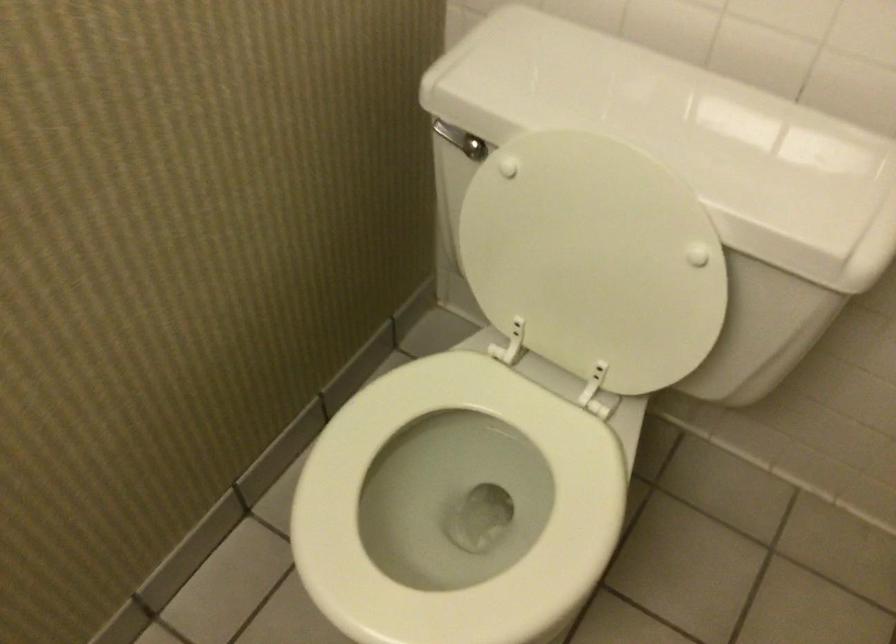
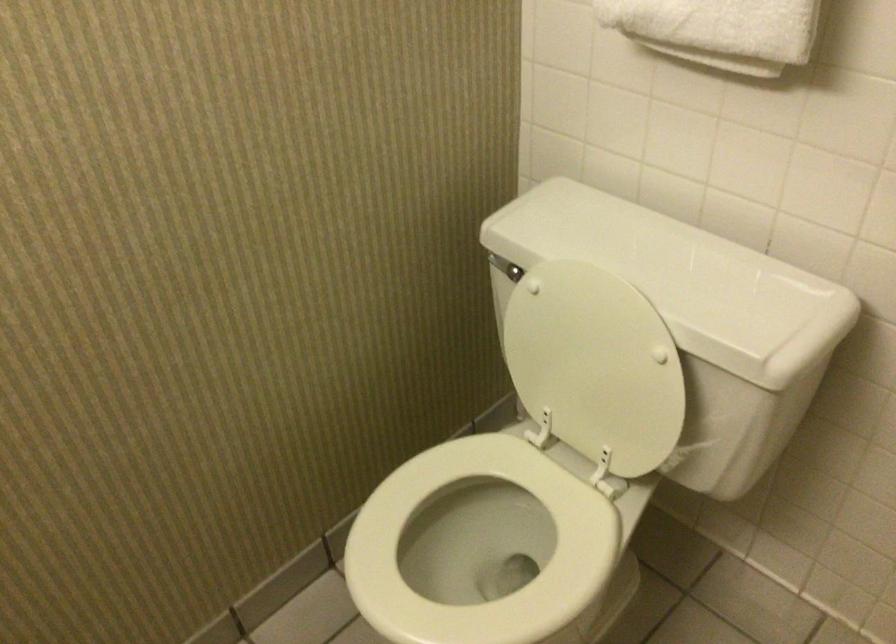
Consider the image. In a continuous first-person perspective shot, in which direction is the camera moving?

The cameraman moved toward right, backward.